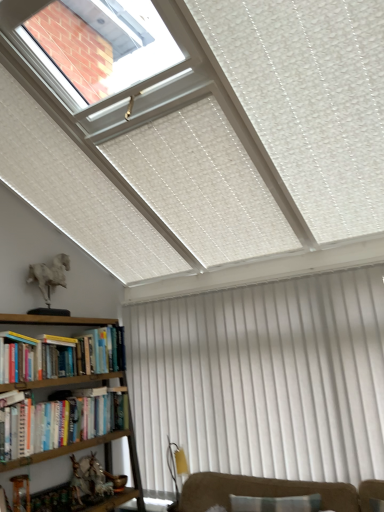
Question: Can you confirm if white textured curtain at lower right is shorter than hardcover book at left, which ranks as the 1th book in top-to-bottom order?

Choices:
 (A) yes
 (B) no

Answer: (B)

Question: Considering the relative positions of white textured curtain at lower right and hardcover book at left, which ranks as the 1th book in top-to-bottom order, in the image provided, is white textured curtain at lower right to the right of hardcover book at left, which ranks as the 1th book in top-to-bottom order, from the viewer's perspective?

Choices:
 (A) yes
 (B) no

Answer: (A)

Question: Does white textured curtain at lower right have a greater width compared to hardcover book at left, which ranks as the 1th book in top-to-bottom order?

Choices:
 (A) yes
 (B) no

Answer: (B)

Question: Is white textured curtain at lower right directly adjacent to hardcover book at left, which ranks as the 1th book in top-to-bottom order?

Choices:
 (A) yes
 (B) no

Answer: (B)

Question: Is white textured curtain at lower right bigger than hardcover book at left, marked as the third book in a bottom-to-top arrangement?

Choices:
 (A) no
 (B) yes

Answer: (B)

Question: Is white textured curtain at lower right spatially inside wooden bookshelf at lower left, or outside of it?

Choices:
 (A) outside
 (B) inside

Answer: (A)

Question: Is white textured curtain at lower right bigger or smaller than wooden bookshelf at lower left?

Choices:
 (A) big
 (B) small

Answer: (B)

Question: From a real-world perspective, is white textured curtain at lower right above or below wooden bookshelf at lower left?

Choices:
 (A) below
 (B) above

Answer: (B)

Question: From the image's perspective, relative to wooden bookshelf at lower left, is white textured curtain at lower right above or below?

Choices:
 (A) below
 (B) above

Answer: (B)

Question: Considering their positions, is hardcover book at left, positioned as the second book in bottom-to-top order, located in front of or behind hardcover book at lower left, positioned as the 1th book in bottom-to-top order?

Choices:
 (A) front
 (B) behind

Answer: (B)

Question: Is point (104, 331) positioned closer to the camera than point (36, 404)?

Choices:
 (A) closer
 (B) farther

Answer: (B)

Question: Considering the relative positions of hardcover book at left, positioned as the second book in bottom-to-top order, and hardcover book at lower left, positioned as the 1th book in bottom-to-top order, in the image provided, is hardcover book at left, positioned as the second book in bottom-to-top order, to the left or to the right of hardcover book at lower left, positioned as the 1th book in bottom-to-top order,?

Choices:
 (A) right
 (B) left

Answer: (A)

Question: Considering the positions of hardcover book at left, positioned as the second book in bottom-to-top order, and hardcover book at lower left, the 3th book positioned from the top, in the image, is hardcover book at left, positioned as the second book in bottom-to-top order, wider or thinner than hardcover book at lower left, the 3th book positioned from the top,?

Choices:
 (A) thin
 (B) wide

Answer: (A)

Question: Does point (109, 67) appear closer or farther from the camera than point (340, 357)?

Choices:
 (A) closer
 (B) farther

Answer: (A)

Question: From the image's perspective, is white plastic skylight at upper left positioned above or below white textured curtain at lower right?

Choices:
 (A) below
 (B) above

Answer: (B)